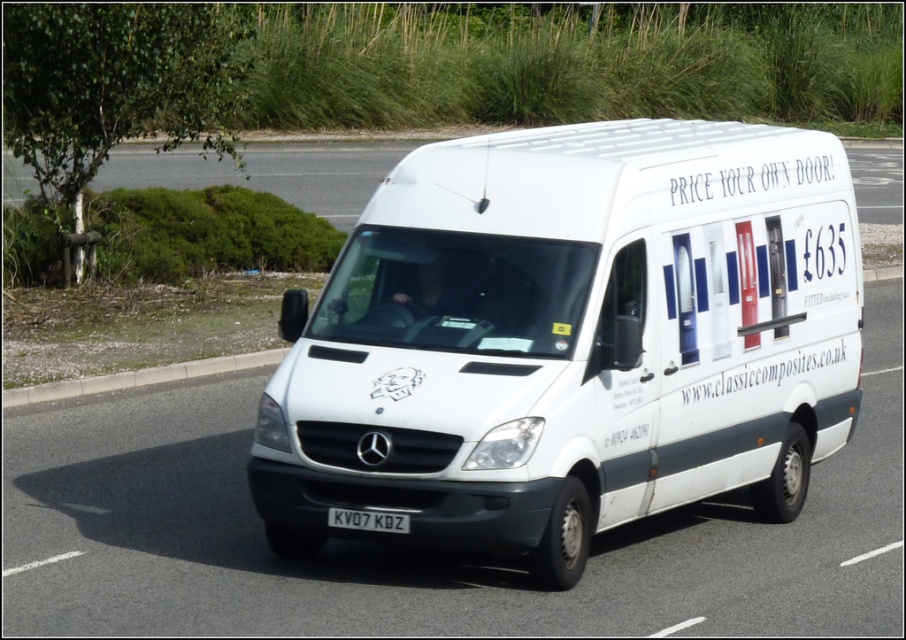
You are a delivery driver who needs to park the white matte van at center near the concrete at lower left. The parking space is exactly 6 meters long. Can the van fit in the space?

The white matte van at center is 6.02 meters from concrete at lower left, so it cannot fit in the 6 meter parking space as it is slightly longer.

You are a delivery driver who needs to check the license plate of the van. You see the concrete at lower left and the black metallic license plate at center. Which object is larger in size?

The concrete at lower left is bigger than the black metallic license plate at center.

You are a delivery driver who needs to park your van on the concrete at lower left. The van has a license plate KV07 KDZ. Where should you position your van so that the van is parked precisely at the point marked by point (138, 378) on the concrete at lower left?

You should position your van so that its license plate KV07 KDZ is aligned with the point (138, 378) on the concrete at lower left.